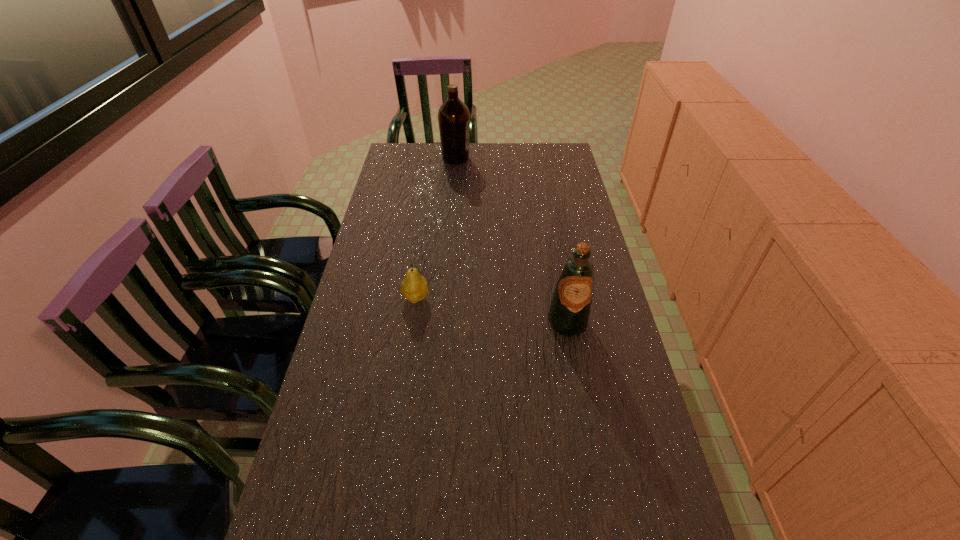
The width and height of the screenshot is (960, 540). Find the location of `the left olive oil`. the left olive oil is located at coordinates (453, 116).

Identify the location of the farthest object. The width and height of the screenshot is (960, 540). (453, 116).

Locate an element on the screen. The image size is (960, 540). the right olive oil is located at coordinates (570, 310).

The image size is (960, 540). I want to click on the rightmost object, so click(570, 310).

The width and height of the screenshot is (960, 540). I want to click on pear, so click(414, 287).

The image size is (960, 540). In order to click on free space located 0.150m on the label of the farther olive oil in this screenshot , I will do `click(507, 158)`.

Locate an element on the screen. free space located on the front-facing side of the nearer olive oil is located at coordinates coord(577,375).

Where is `vacant space situated 0.390m on the back of the pear`? The height and width of the screenshot is (540, 960). vacant space situated 0.390m on the back of the pear is located at coordinates (429, 209).

Locate an element on the screen. Image resolution: width=960 pixels, height=540 pixels. object at the far edge is located at coordinates (453, 116).

At what (x,y) coordinates should I click in order to perform the action: click on object located in the left edge section of the desktop. Please return your answer as a coordinate pair (x, y). This screenshot has width=960, height=540. Looking at the image, I should click on click(414, 287).